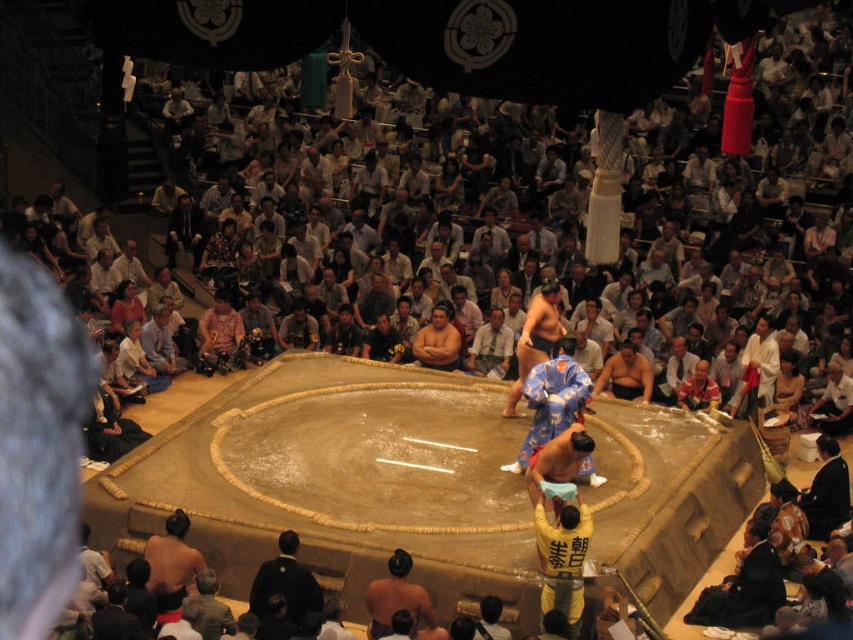
Who is shorter, blue silk kimono at center or brown textured kimono at center?

brown textured kimono at center is shorter.

Where is `blue silk kimono at center`? The height and width of the screenshot is (640, 853). blue silk kimono at center is located at coordinates (550, 401).

Does blue silk kimono at center have a larger size compared to fat man at center?

Correct, blue silk kimono at center is larger in size than fat man at center.

Is blue silk kimono at center shorter than fat man at center?

In fact, blue silk kimono at center may be taller than fat man at center.

Consider the image. Who is more distant from viewer, (561, 356) or (456, 339)?

Positioned behind is point (456, 339).

In order to click on blue silk kimono at center in this screenshot , I will do `click(550, 401)`.

Is black silk kimono at center above brown skin sumo at lower left?

Actually, black silk kimono at center is below brown skin sumo at lower left.

Can you confirm if black silk kimono at center is wider than brown skin sumo at lower left?

Yes, black silk kimono at center is wider than brown skin sumo at lower left.

Image resolution: width=853 pixels, height=640 pixels. Describe the element at coordinates (286, 582) in the screenshot. I see `black silk kimono at center` at that location.

Where is `black silk kimono at center`? black silk kimono at center is located at coordinates (286, 582).